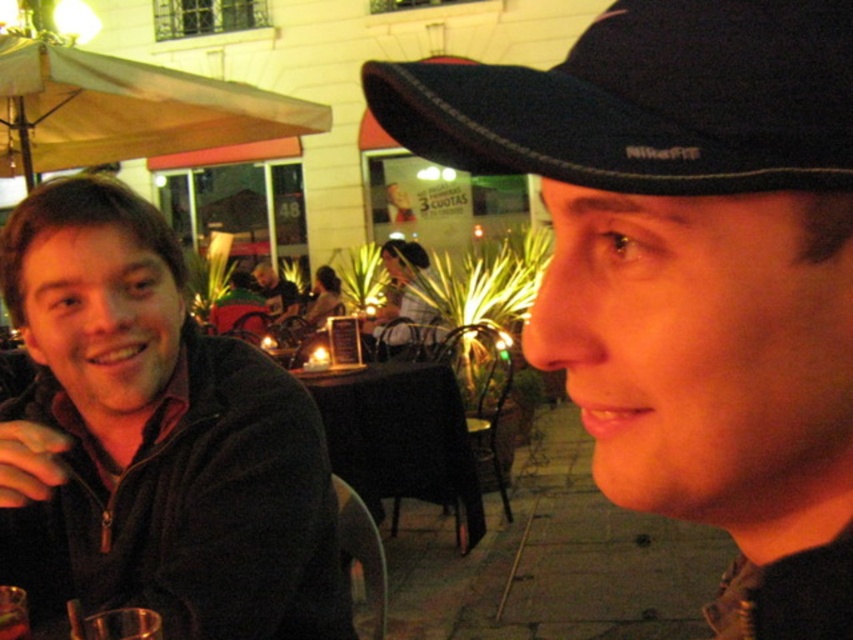
This screenshot has height=640, width=853. In order to click on black nikefit cap at upper right in this screenshot , I will do `click(647, 100)`.

Does black nikefit cap at upper right have a greater height compared to black matte table at center?

No, black nikefit cap at upper right is not taller than black matte table at center.

The height and width of the screenshot is (640, 853). I want to click on black nikefit cap at upper right, so click(647, 100).

Find the location of a particular element. black nikefit cap at upper right is located at coordinates (647, 100).

Does point (815, 76) come farther from viewer compared to point (392, 330)?

No, (815, 76) is closer to viewer.

Who is more distant from viewer, (780, 125) or (392, 344)?

Positioned behind is point (392, 344).

Where is `black nikefit cap at upper right`? The height and width of the screenshot is (640, 853). black nikefit cap at upper right is located at coordinates (647, 100).

Between point (546, 147) and point (149, 419), which one is positioned behind?

The point (149, 419) is behind.

Which of these two, black matte hat at upper right or matte black jacket at left, stands taller?

With more height is matte black jacket at left.

Describe the element at coordinates (689, 268) in the screenshot. I see `black matte hat at upper right` at that location.

Find the location of a particular element. black matte hat at upper right is located at coordinates (689, 268).